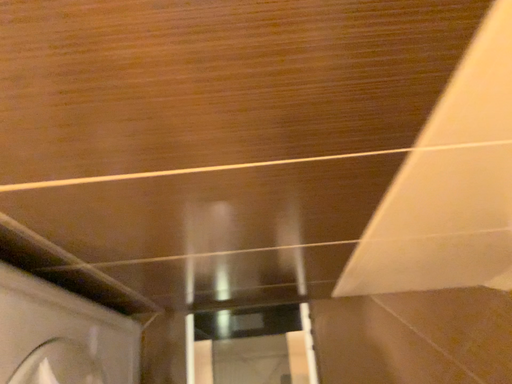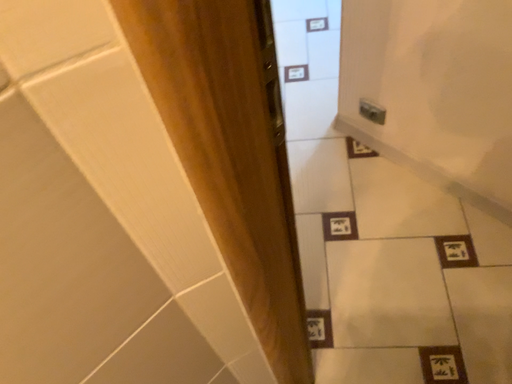
Question: Which way did the camera rotate in the video?

Choices:
 (A) rotated downward
 (B) rotated upward

Answer: (B)